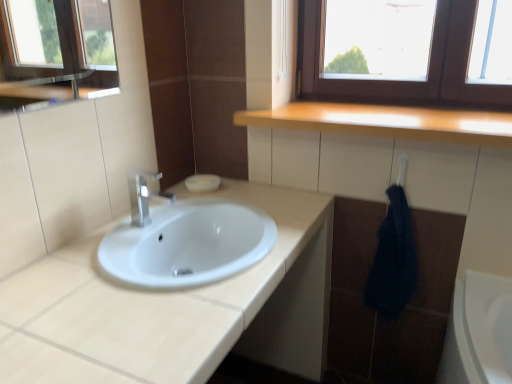
Question: Does light wood countertop at upper center appear on the right side of white glossy sink at center?

Choices:
 (A) no
 (B) yes

Answer: (B)

Question: Considering the relative sizes of light wood countertop at upper center and white glossy sink at center in the image provided, is light wood countertop at upper center smaller than white glossy sink at center?

Choices:
 (A) no
 (B) yes

Answer: (B)

Question: Is light wood countertop at upper center turned away from white glossy sink at center?

Choices:
 (A) yes
 (B) no

Answer: (B)

Question: Considering the relative sizes of light wood countertop at upper center and white glossy sink at center in the image provided, is light wood countertop at upper center shorter than white glossy sink at center?

Choices:
 (A) no
 (B) yes

Answer: (B)

Question: From a real-world perspective, is light wood countertop at upper center physically above white glossy sink at center?

Choices:
 (A) yes
 (B) no

Answer: (A)

Question: Is light wood countertop at upper center with white glossy sink at center?

Choices:
 (A) yes
 (B) no

Answer: (B)

Question: Could satin nickel faucet at center be considered to be inside light wood countertop at upper center?

Choices:
 (A) yes
 (B) no

Answer: (B)

Question: Considering the relative positions of light wood countertop at upper center and satin nickel faucet at center in the image provided, is light wood countertop at upper center to the left of satin nickel faucet at center from the viewer's perspective?

Choices:
 (A) no
 (B) yes

Answer: (A)

Question: Does light wood countertop at upper center appear on the right side of satin nickel faucet at center?

Choices:
 (A) no
 (B) yes

Answer: (B)

Question: Is light wood countertop at upper center directly adjacent to satin nickel faucet at center?

Choices:
 (A) yes
 (B) no

Answer: (B)

Question: Does light wood countertop at upper center have a smaller size compared to satin nickel faucet at center?

Choices:
 (A) no
 (B) yes

Answer: (A)

Question: From the image's perspective, is light wood countertop at upper center beneath satin nickel faucet at center?

Choices:
 (A) yes
 (B) no

Answer: (B)

Question: Is dark blue textured towel at right closer to the viewer compared to light wood countertop at upper center?

Choices:
 (A) yes
 (B) no

Answer: (B)